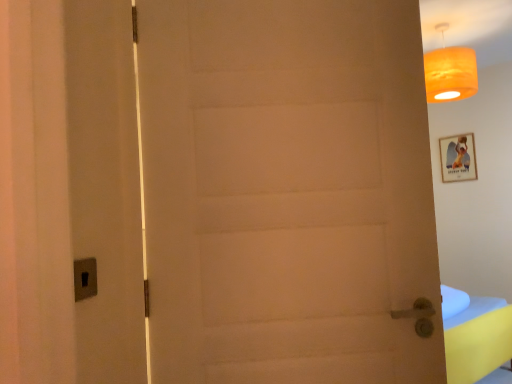
Question: Is wooden framed picture at upper right inside orange fabric lampshade at upper right?

Choices:
 (A) yes
 (B) no

Answer: (B)

Question: Are orange fabric lampshade at upper right and wooden framed picture at upper right located far from each other?

Choices:
 (A) no
 (B) yes

Answer: (B)

Question: Is orange fabric lampshade at upper right at the left side of wooden framed picture at upper right?

Choices:
 (A) yes
 (B) no

Answer: (A)

Question: Does orange fabric lampshade at upper right appear on the right side of wooden framed picture at upper right?

Choices:
 (A) yes
 (B) no

Answer: (B)

Question: From a real-world perspective, is orange fabric lampshade at upper right located beneath wooden framed picture at upper right?

Choices:
 (A) yes
 (B) no

Answer: (B)

Question: Is orange fabric lampshade at upper right closer to camera compared to wooden framed picture at upper right?

Choices:
 (A) yes
 (B) no

Answer: (A)

Question: Is white matte door at center positioned before wooden framed picture at upper right?

Choices:
 (A) yes
 (B) no

Answer: (A)

Question: Can you confirm if white matte door at center is wider than wooden framed picture at upper right?

Choices:
 (A) no
 (B) yes

Answer: (B)

Question: Is white matte door at center thinner than wooden framed picture at upper right?

Choices:
 (A) no
 (B) yes

Answer: (A)

Question: Considering the relative sizes of white matte door at center and wooden framed picture at upper right in the image provided, is white matte door at center taller than wooden framed picture at upper right?

Choices:
 (A) no
 (B) yes

Answer: (B)

Question: From the image's perspective, is white matte door at center beneath wooden framed picture at upper right?

Choices:
 (A) no
 (B) yes

Answer: (B)

Question: Is white matte door at center aimed at wooden framed picture at upper right?

Choices:
 (A) yes
 (B) no

Answer: (B)

Question: From the image's perspective, does white matte door at center appear lower than orange fabric lampshade at upper right?

Choices:
 (A) yes
 (B) no

Answer: (A)